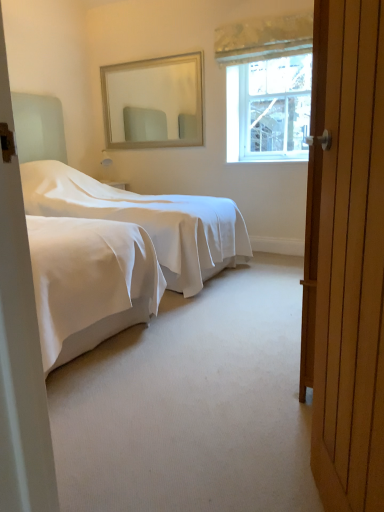
At what (x,y) coordinates should I click in order to perform the action: click on white smooth bed at center. Please return your answer as a coordinate pair (x, y). The image size is (384, 512). Looking at the image, I should click on (128, 202).

This screenshot has width=384, height=512. What do you see at coordinates (128, 202) in the screenshot?
I see `white smooth bed at center` at bounding box center [128, 202].

Describe the element at coordinates (274, 106) in the screenshot. This screenshot has height=512, width=384. I see `clear glass window at upper right` at that location.

I want to click on beige framed mirror at upper center, so click(x=154, y=102).

From the image's perspective, which one is positioned higher, white smooth bed at center or textured cream curtain at upper center?

textured cream curtain at upper center is shown above in the image.

Does white smooth bed at center turn towards textured cream curtain at upper center?

No.

Measure the distance from white smooth bed at center to textured cream curtain at upper center.

The distance of white smooth bed at center from textured cream curtain at upper center is 1.72 meters.

Which object is positioned more to the right, white smooth bed at center or textured cream curtain at upper center?

From the viewer's perspective, textured cream curtain at upper center appears more on the right side.

Can we say clear glass window at upper right lies outside wooden door at right?

clear glass window at upper right is positioned outside wooden door at right.

Between clear glass window at upper right and wooden door at right, which one has larger width?

wooden door at right.

How much distance is there between clear glass window at upper right and wooden door at right?

A distance of 2.99 meters exists between clear glass window at upper right and wooden door at right.

Considering the sizes of objects clear glass window at upper right and wooden door at right in the image provided, who is bigger, clear glass window at upper right or wooden door at right?

Bigger between the two is wooden door at right.

Is beige framed mirror at upper center in front of or behind clear glass window at upper right in the image?

In the image, beige framed mirror at upper center appears behind clear glass window at upper right.

Is point (199, 59) positioned in front of point (263, 67)?

Yes, it is in front of point (263, 67).

Can you confirm if beige framed mirror at upper center is positioned to the left of clear glass window at upper right?

Yes, beige framed mirror at upper center is to the left of clear glass window at upper right.

Based on the photo, is beige framed mirror at upper center oriented towards clear glass window at upper right?

No, beige framed mirror at upper center is not oriented towards clear glass window at upper right.

Which is in front, point (251, 28) or point (254, 132)?

The point (251, 28) is closer to the camera.

How many degrees apart are the facing directions of textured cream curtain at upper center and clear glass window at upper right?

1.62 degrees separate the facing orientations of textured cream curtain at upper center and clear glass window at upper right.

From a real-world perspective, is textured cream curtain at upper center above or below clear glass window at upper right?

textured cream curtain at upper center is above clear glass window at upper right.

Consider the image. Considering the sizes of objects white smooth bed at center and wooden door at right in the image provided, who is wider, white smooth bed at center or wooden door at right?

white smooth bed at center.

From a real-world perspective, is white smooth bed at center physically above wooden door at right?

Yes, from a real-world perspective, white smooth bed at center is over wooden door at right

How different are the orientations of white smooth bed at center and wooden door at right in degrees?

white smooth bed at center and wooden door at right are facing 152 degrees away from each other.

Consider the image. Is white smooth bed at center looking in the opposite direction of wooden door at right?

No.

Is beige framed mirror at upper center inside the boundaries of wooden door at right, or outside?

beige framed mirror at upper center is located beyond the bounds of wooden door at right.

Is beige framed mirror at upper center far away from wooden door at right?

Absolutely, beige framed mirror at upper center is distant from wooden door at right.

Which is more to the left, beige framed mirror at upper center or wooden door at right?

beige framed mirror at upper center is more to the left.

From a real-world perspective, between beige framed mirror at upper center and wooden door at right, who is vertically lower?

A: In real-world perspective, wooden door at right is lower.

Between point (331, 268) and point (55, 143), which one is positioned behind?

The point (55, 143) is behind.

Between wooden door at right and white smooth bed at center, which one has larger width?

With larger width is white smooth bed at center.

Do you think wooden door at right is within white smooth bed at center, or outside of it?

wooden door at right cannot be found inside white smooth bed at center.

Locate an element on the screen. The height and width of the screenshot is (512, 384). curtain lying behind the white smooth bed at center is located at coordinates (263, 38).

This screenshot has height=512, width=384. In order to click on door located on the left of clear glass window at upper right in this screenshot , I will do click(x=347, y=255).

Looking at the image, which one is located further to beige framed mirror at upper center, clear glass window at upper right or white smooth bed at center?

white smooth bed at center.

Which object lies nearer to the anchor point beige framed mirror at upper center, white smooth bed at center or clear glass window at upper right?

clear glass window at upper right is positioned closer to the anchor beige framed mirror at upper center.

When comparing their distances from clear glass window at upper right, does white smooth bed at center or beige framed mirror at upper center seem further?

Among the two, white smooth bed at center is located further to clear glass window at upper right.

Estimate the real-world distances between objects in this image. Which object is closer to textured cream curtain at upper center, clear glass window at upper right or wooden door at right?

clear glass window at upper right is closer to textured cream curtain at upper center.

Looking at the image, which one is located closer to textured cream curtain at upper center, wooden door at right or white smooth bed at center?

white smooth bed at center.

Considering their positions, is beige framed mirror at upper center positioned further to wooden door at right than clear glass window at upper right?

beige framed mirror at upper center is positioned further to the anchor wooden door at right.

Estimate the real-world distances between objects in this image. Which object is closer to clear glass window at upper right, wooden door at right or beige framed mirror at upper center?

beige framed mirror at upper center is closer to clear glass window at upper right.

Which object lies further to the anchor point textured cream curtain at upper center, white smooth bed at center or clear glass window at upper right?

Among the two, white smooth bed at center is located further to textured cream curtain at upper center.

At what (x,y) coordinates should I click in order to perform the action: click on curtain between wooden door at right and clear glass window at upper right along the z-axis. Please return your answer as a coordinate pair (x, y). The height and width of the screenshot is (512, 384). Looking at the image, I should click on (263, 38).

At what (x,y) coordinates should I click in order to perform the action: click on window screen between white smooth bed at center and beige framed mirror at upper center along the z-axis. Please return your answer as a coordinate pair (x, y). Image resolution: width=384 pixels, height=512 pixels. Looking at the image, I should click on pyautogui.click(x=274, y=106).

Where is `window screen between wooden door at right and beige framed mirror at upper center along the z-axis`? The height and width of the screenshot is (512, 384). window screen between wooden door at right and beige framed mirror at upper center along the z-axis is located at coordinates (274, 106).

Image resolution: width=384 pixels, height=512 pixels. In order to click on bed located between wooden door at right and beige framed mirror at upper center in the depth direction in this screenshot , I will do `click(128, 202)`.